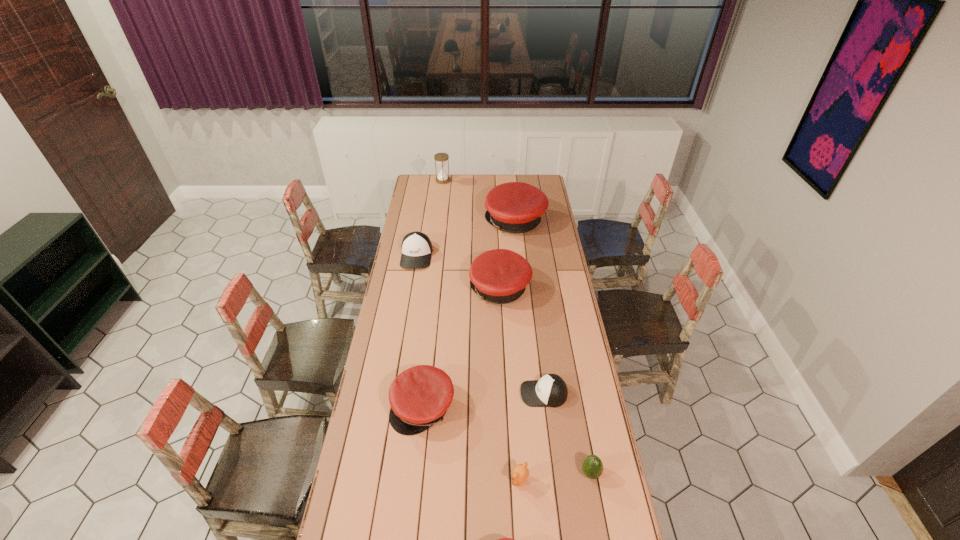
Identify the location of vacant point located between the farthest object and the second nearest red cap. (433, 294).

Where is `object identified as the second closest to the green avocado`? object identified as the second closest to the green avocado is located at coordinates (551, 390).

This screenshot has width=960, height=540. What are the coordinates of `object that is the fifth closest to the avocado` in the screenshot? It's located at 500,276.

At what (x,y) coordinates should I click in order to perform the action: click on the second closest cap relative to the nearer gray cap. Please return your answer as a coordinate pair (x, y). This screenshot has height=540, width=960. Looking at the image, I should click on (500, 276).

Select which cap is the fifth closest to the third tallest object. Please provide its 2D coordinates. Your answer should be formatted as a tuple, i.e. [(x, y)], where the tuple contains the x and y coordinates of a point satisfying the conditions above.

[(503, 539)]

Choose which red cap is the third nearest neighbor to the right gray cap. Please provide its 2D coordinates. Your answer should be formatted as a tuple, i.e. [(x, y)], where the tuple contains the x and y coordinates of a point satisfying the conditions above.

[(503, 539)]

Identify the location of red cap that stands as the third closest to the smallest red cap. The image size is (960, 540). (516, 207).

You are a GUI agent. You are given a task and a screenshot of the screen. Output one action in this format:
    pyautogui.click(x=<x>, y=<y>)
    Task: Click on the free region that satisfies the following two spatial constraints: 1. at the front of the seventh shortest object where the visor is located; 2. on the back side of the avocado
    This screenshot has width=960, height=540.
    Given the screenshot: What is the action you would take?
    pyautogui.click(x=509, y=474)

Image resolution: width=960 pixels, height=540 pixels. I want to click on vacant region that satisfies the following two spatial constraints: 1. at the front of the green avocado where the visor is located; 2. on the left side of the second nearest red cap, so click(x=416, y=474).